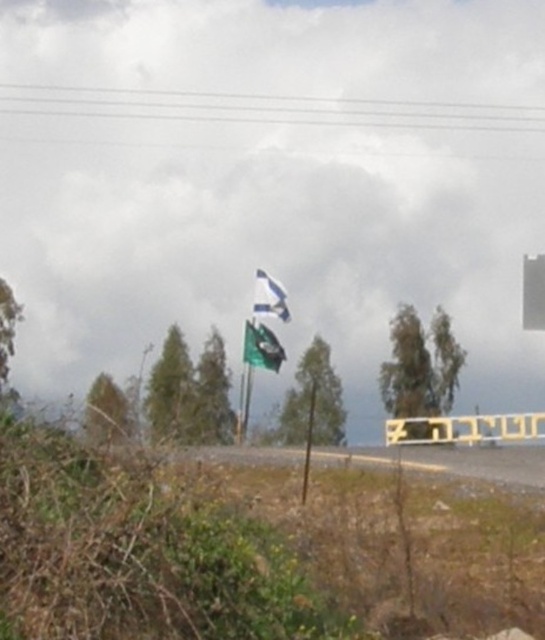
Does yellow plastic sign at center have a larger size compared to green fabric flag at center?

No, yellow plastic sign at center is not bigger than green fabric flag at center.

Is yellow plastic sign at center smaller than green fabric flag at center?

Yes.

Is point (456, 417) positioned before point (284, 353)?

Yes, it is in front of point (284, 353).

Locate an element on the screen. yellow plastic sign at center is located at coordinates (464, 428).

Which is above, yellow plastic sign at center or white fabric flag at upper center?

white fabric flag at upper center is above.

Which is more to the left, yellow plastic sign at center or white fabric flag at upper center?

white fabric flag at upper center

Is point (419, 419) behind point (272, 307)?

No, it is not.

The height and width of the screenshot is (640, 545). In order to click on yellow plastic sign at center in this screenshot , I will do `click(464, 428)`.

Which is more to the right, green fabric flag at center or white fabric flag at upper center?

green fabric flag at center

What do you see at coordinates (262, 348) in the screenshot? The image size is (545, 640). I see `green fabric flag at center` at bounding box center [262, 348].

Where is `green fabric flag at center`? green fabric flag at center is located at coordinates (262, 348).